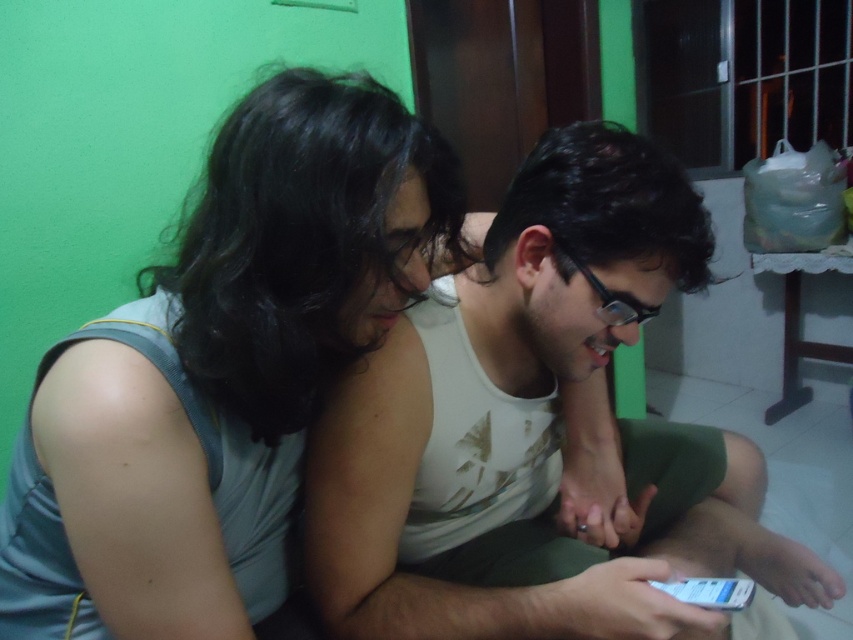
Question: Which point is closer to the camera?

Choices:
 (A) (91, 502)
 (B) (317, 442)

Answer: (A)

Question: Is gray fabric shirt at left closer to the viewer compared to white matte tank top at center?

Choices:
 (A) yes
 (B) no

Answer: (A)

Question: Which point is farther to the camera?

Choices:
 (A) gray fabric shirt at left
 (B) white matte tank top at center

Answer: (B)

Question: Among these points, which one is nearest to the camera?

Choices:
 (A) (137, 540)
 (B) (543, 308)

Answer: (A)

Question: Can you confirm if gray fabric shirt at left is positioned to the left of white matte tank top at center?

Choices:
 (A) no
 (B) yes

Answer: (B)

Question: Can you confirm if gray fabric shirt at left is positioned to the right of white matte tank top at center?

Choices:
 (A) no
 (B) yes

Answer: (A)